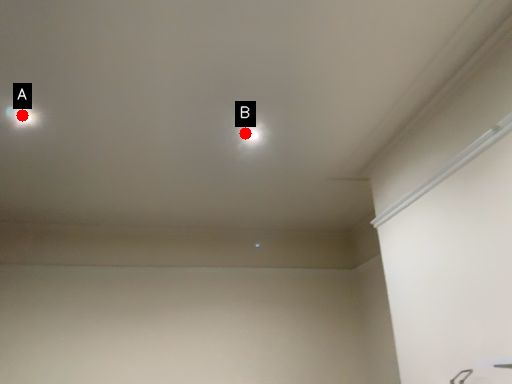
Question: Two points are circled on the image, labeled by A and B beside each circle. Which of the following is the farthest from the observer?

Choices:
 (A) A is further
 (B) B is further

Answer: (B)